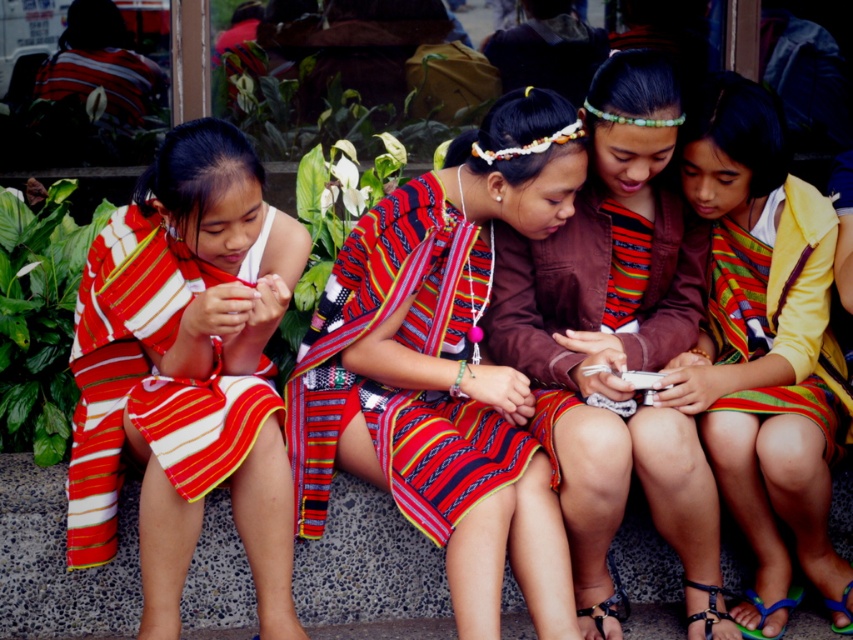
Is point (813, 307) positioned before point (746, 284)?

Yes, it is.

Find the location of a particular element. striped fabric dress at center is located at coordinates (763, 336).

Who is more forward, [726,122] or [781,280]?

Positioned in front is point [726,122].

Identify the location of striped fabric dress at center. This screenshot has height=640, width=853. (763, 336).

Between striped fabric dress at left and blue rubber sandal at lower right, which one has less height?

blue rubber sandal at lower right is shorter.

Who is higher up, striped fabric dress at left or blue rubber sandal at lower right?

Positioned higher is striped fabric dress at left.

What do you see at coordinates (196, 360) in the screenshot? I see `striped fabric dress at left` at bounding box center [196, 360].

Where is `striped fabric dress at left`? The width and height of the screenshot is (853, 640). striped fabric dress at left is located at coordinates (196, 360).

Who is positioned more to the left, textured woven dress at center or blue rubber sandal at lower right?

textured woven dress at center is more to the left.

Describe the element at coordinates (444, 368) in the screenshot. This screenshot has height=640, width=853. I see `textured woven dress at center` at that location.

This screenshot has height=640, width=853. In order to click on textured woven dress at center in this screenshot , I will do `click(444, 368)`.